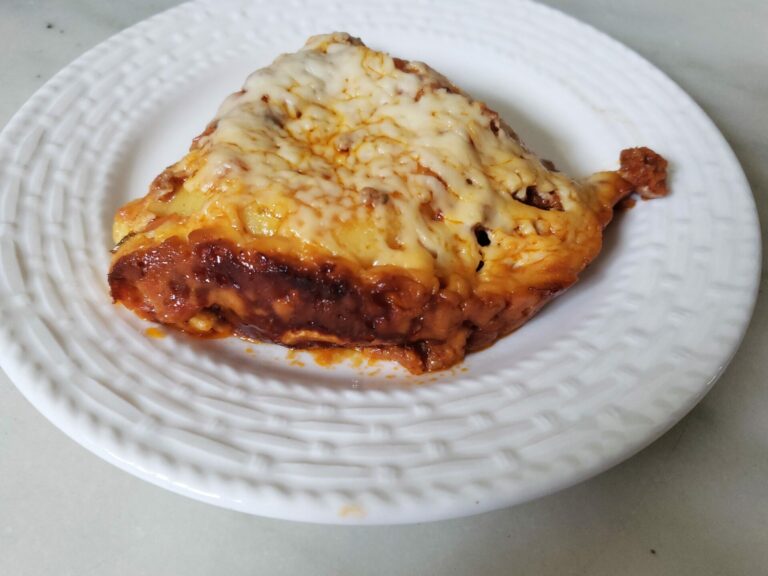
Where is `white plate`? This screenshot has height=576, width=768. white plate is located at coordinates (184, 477).